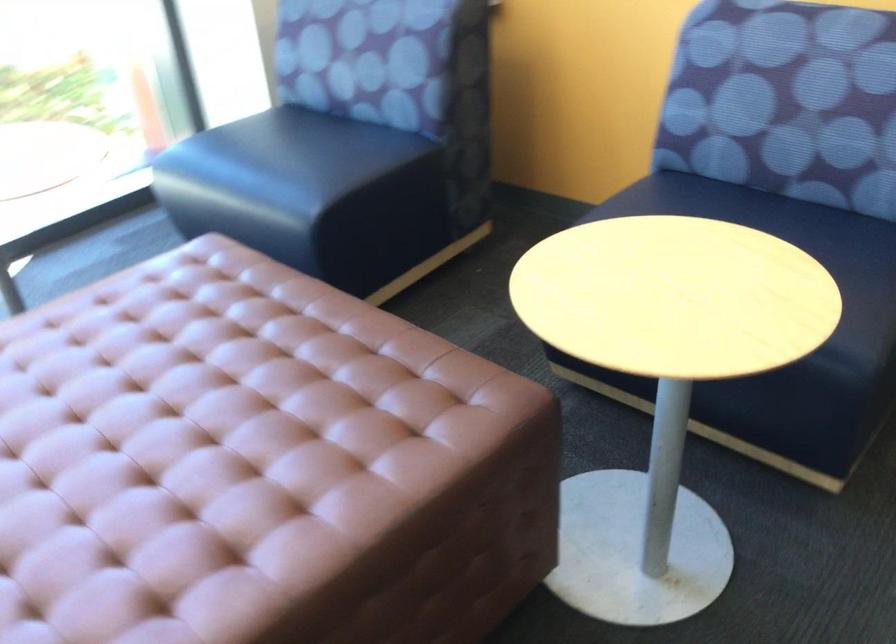
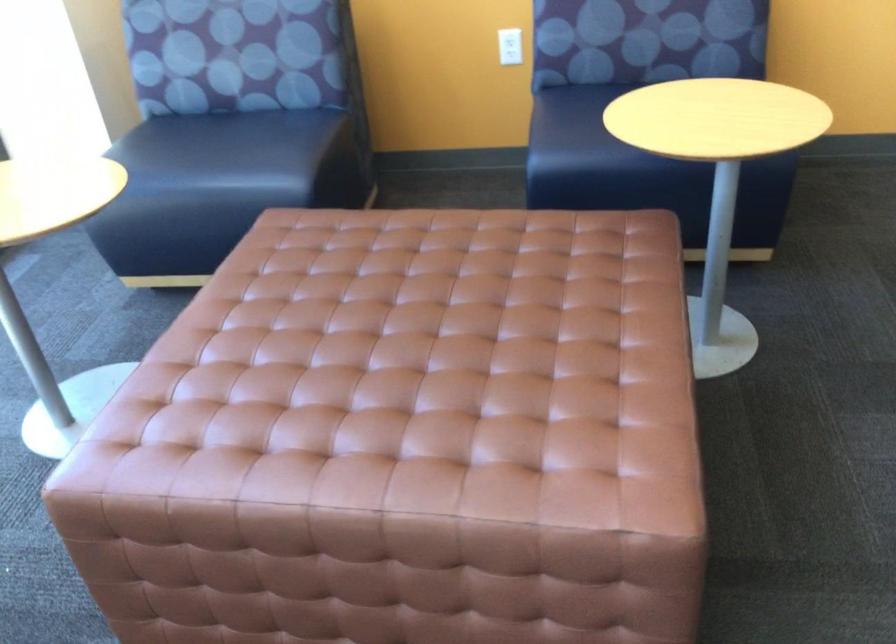
Locate, in the second image, the point that corresponds to (261,146) in the first image.

(199, 149)